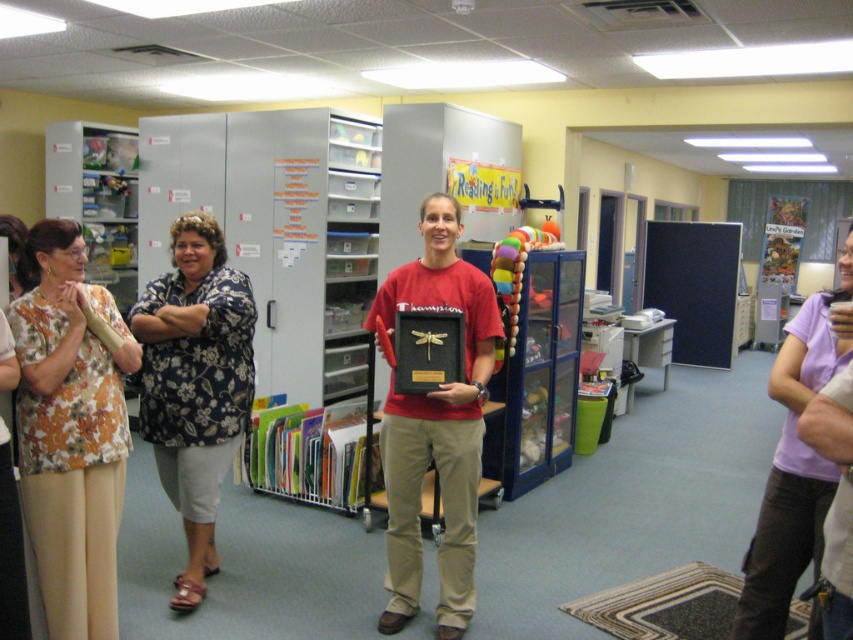
You are an observer in the classroom. You notice two people wearing different shirts. The first is wearing a floral print blouse at left and the second a purple cotton shirt at right. Which of these shirts is taller?

The floral print blouse at left is taller than the purple cotton shirt at right.

You are standing in the classroom and need to hand out a form to both the person in the floral print blouse at left and the person in the purple fabric shirt at center. Which person should you approach first if you want to start with the one closer to the left side of the room?

You should first approach the floral print blouse at left because it is positioned to the left of the purple fabric shirt at center, making it closer to the left side of the room.